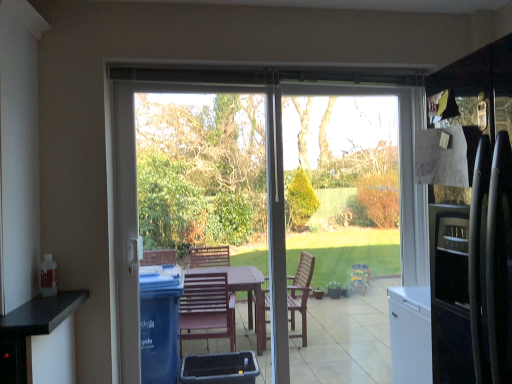
Question: Is transparent plastic screen door at center to the left of transparent glass window screen at center from the viewer's perspective?

Choices:
 (A) yes
 (B) no

Answer: (A)

Question: From the image's perspective, would you say transparent plastic screen door at center is positioned over transparent glass window screen at center?

Choices:
 (A) no
 (B) yes

Answer: (B)

Question: Is transparent plastic screen door at center at the right side of transparent glass window screen at center?

Choices:
 (A) yes
 (B) no

Answer: (B)

Question: Does transparent plastic screen door at center have a lesser width compared to transparent glass window screen at center?

Choices:
 (A) yes
 (B) no

Answer: (B)

Question: Is transparent plastic screen door at center completely or partially outside of transparent glass window screen at center?

Choices:
 (A) no
 (B) yes

Answer: (B)

Question: From the image's perspective, is transparent plastic screen door at center located beneath transparent glass window screen at center?

Choices:
 (A) yes
 (B) no

Answer: (B)

Question: From the image's perspective, is transparent plastic screen door at center on top of transparent glass door at center?

Choices:
 (A) no
 (B) yes

Answer: (B)

Question: From the image's perspective, is transparent plastic screen door at center located beneath transparent glass door at center?

Choices:
 (A) no
 (B) yes

Answer: (A)

Question: Is transparent plastic screen door at center in contact with transparent glass door at center?

Choices:
 (A) no
 (B) yes

Answer: (A)

Question: Does transparent plastic screen door at center turn towards transparent glass door at center?

Choices:
 (A) yes
 (B) no

Answer: (A)

Question: Can you confirm if transparent plastic screen door at center is positioned to the left of transparent glass door at center?

Choices:
 (A) no
 (B) yes

Answer: (B)

Question: Is transparent plastic screen door at center outside transparent glass door at center?

Choices:
 (A) yes
 (B) no

Answer: (B)

Question: From a real-world perspective, is transparent glass door at center under transparent glass window screen at center?

Choices:
 (A) yes
 (B) no

Answer: (A)